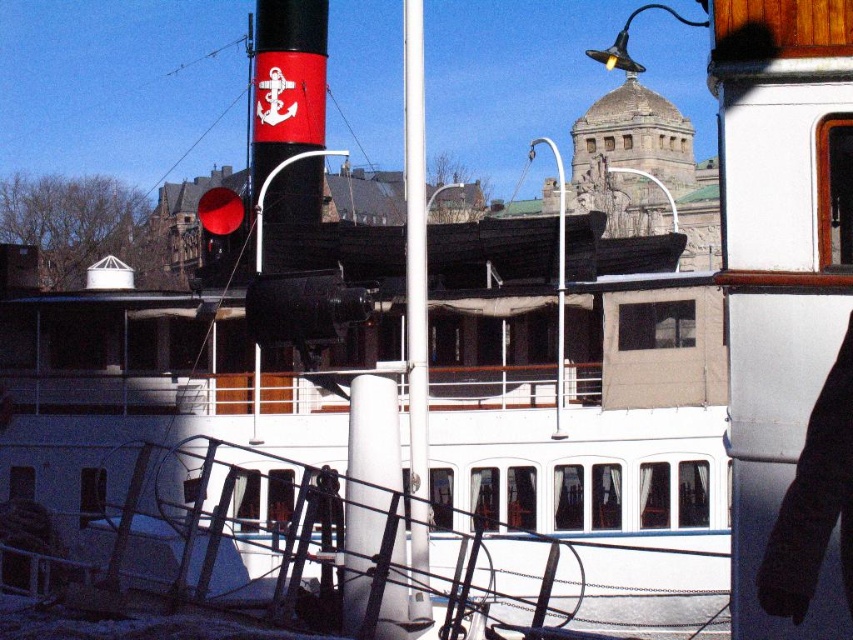
Does white glossy pole at center lie in front of white metal pole at center?

Yes, it is.

Who is positioned more to the right, white glossy pole at center or white metal pole at center?

Positioned to the right is white metal pole at center.

Image resolution: width=853 pixels, height=640 pixels. Describe the element at coordinates (416, 310) in the screenshot. I see `white glossy pole at center` at that location.

Locate an element on the screen. The width and height of the screenshot is (853, 640). white glossy pole at center is located at coordinates (416, 310).